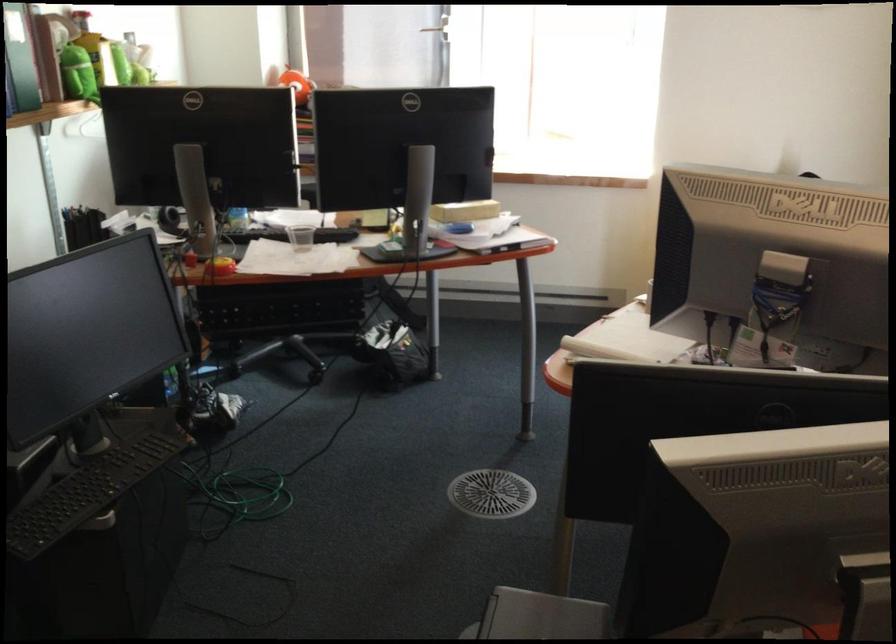
Describe the element at coordinates (95, 49) in the screenshot. I see `a yellow bottle` at that location.